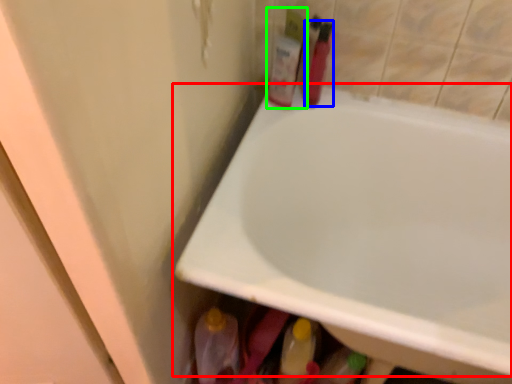
Question: Which object is the farthest from bathtub (highlighted by a red box)? Choose among these: toiletry (highlighted by a blue box) or toiletry (highlighted by a green box).

Choices:
 (A) toiletry
 (B) toiletry

Answer: (A)